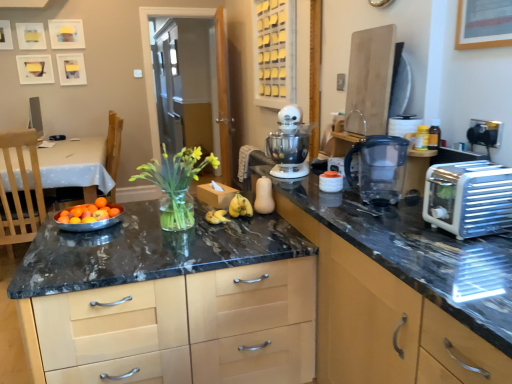
The width and height of the screenshot is (512, 384). I want to click on free point below translucent glass vase at center (from a real-world perspective), so click(x=185, y=228).